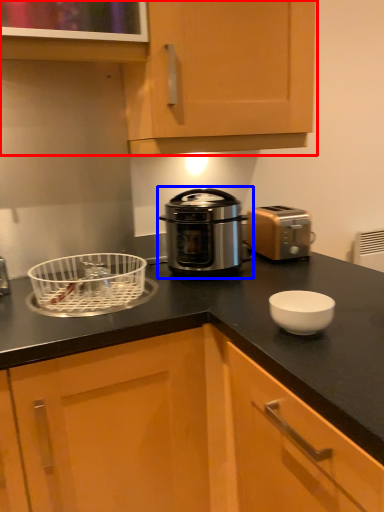
Question: Which object appears closest to the camera in this image, cabinetry (highlighted by a red box) or home appliance (highlighted by a blue box)?

Choices:
 (A) cabinetry
 (B) home appliance

Answer: (A)